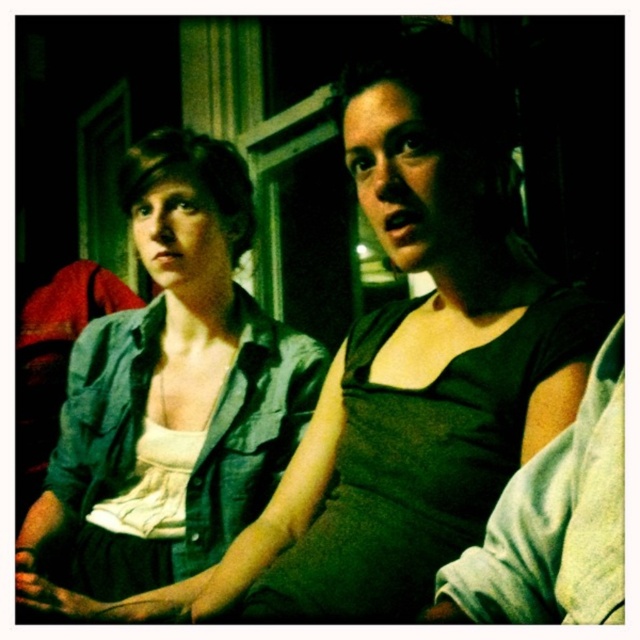
Measure the distance from denim shirt at left to dark green fabric at center.

The distance of denim shirt at left from dark green fabric at center is 26.20 inches.

Which is in front, point (179, 406) or point (593, 432)?

Positioned in front is point (593, 432).

Where is `denim shirt at left`? Image resolution: width=640 pixels, height=640 pixels. denim shirt at left is located at coordinates (168, 403).